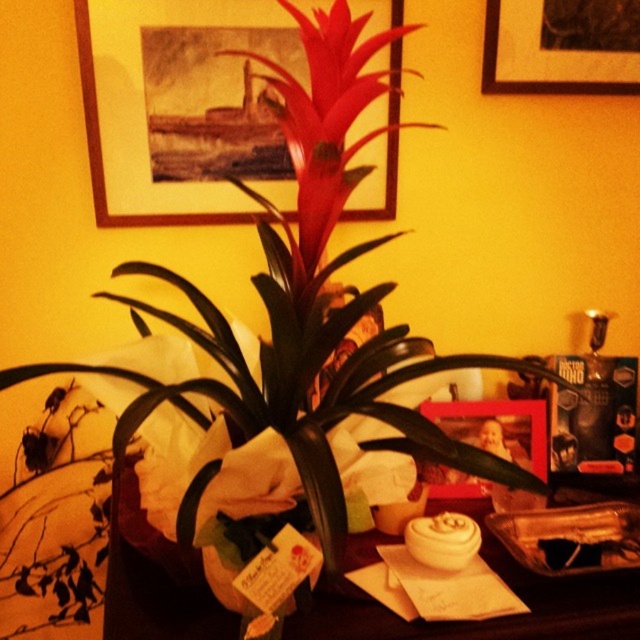
Question: Does wooden framed picture at upper center appear on the left side of wooden photo frame at center?

Choices:
 (A) yes
 (B) no

Answer: (A)

Question: Estimate the real-world distances between objects in this image. Which object is closer to the wooden framed picture at upper center?

Choices:
 (A) matte black table at center
 (B) wooden picture frame at upper center

Answer: (B)

Question: Is wooden picture frame at upper center positioned at the back of green matte vase at center?

Choices:
 (A) no
 (B) yes

Answer: (B)

Question: Estimate the real-world distances between objects in this image. Which object is closer to the wooden picture frame at upper center?

Choices:
 (A) wooden photo frame at center
 (B) matte black table at center
 (C) wooden framed picture at upper center

Answer: (C)

Question: Which point appears closest to the camera in this image?

Choices:
 (A) (435, 467)
 (B) (124, 225)
 (C) (212, 550)
 (D) (211, 630)

Answer: (D)

Question: Does matte black table at center appear over wooden photo frame at center?

Choices:
 (A) no
 (B) yes

Answer: (A)